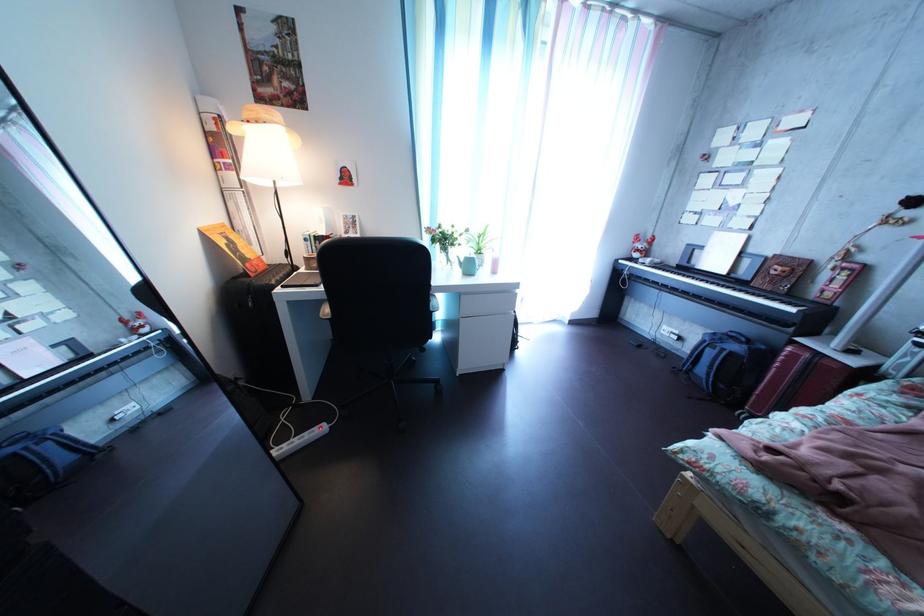
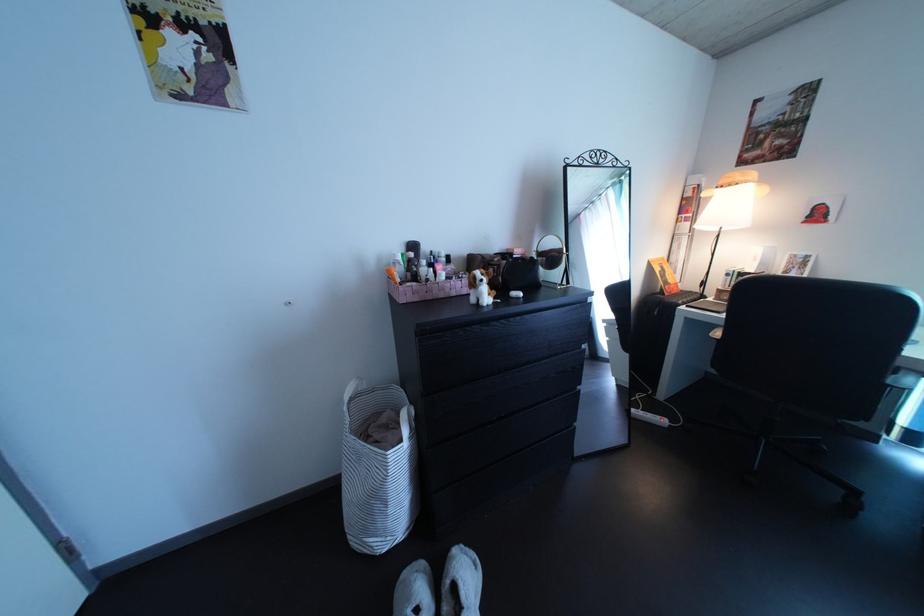
Find the pixel in the second image that matches (330,436) in the first image.

(673, 424)